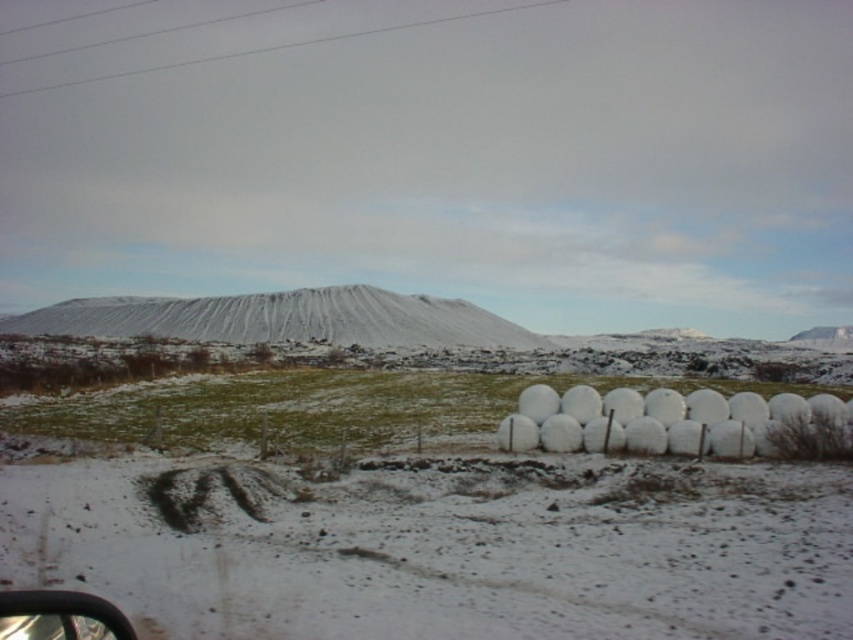
You are standing at the point marked as point [283,320] in the image. What do you see directly in front of you?

At point [283,320], you see a white snow covered mountain at center directly in front of you.